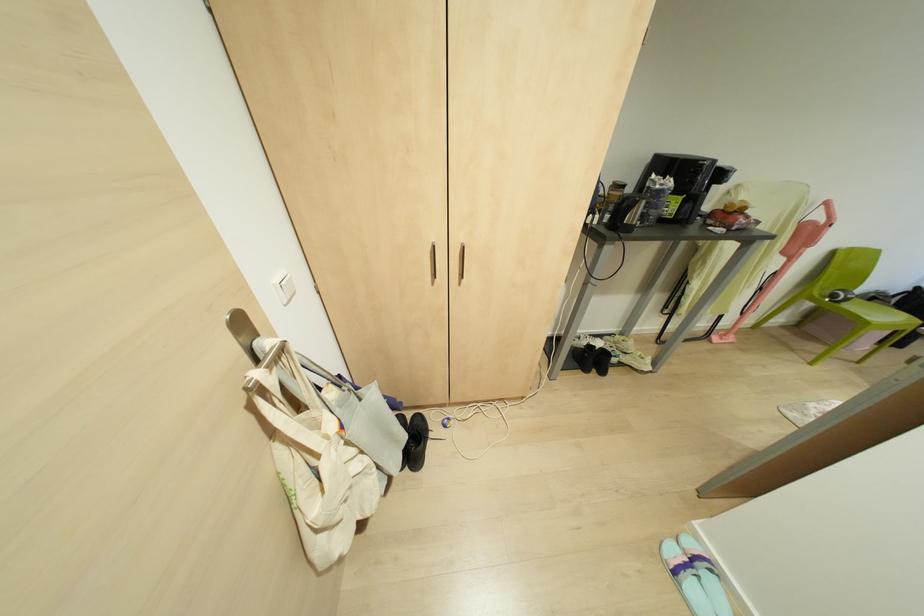
The width and height of the screenshot is (924, 616). Find the location of `white sneaker`. white sneaker is located at coordinates (685, 578).